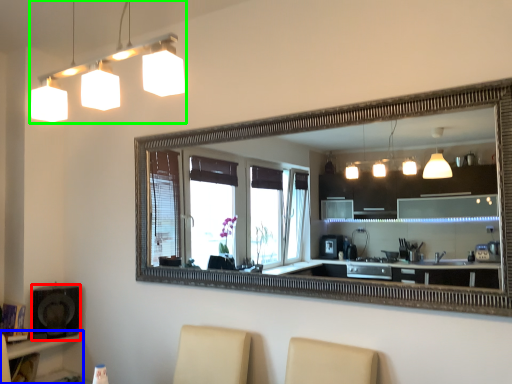
Question: Estimate the real-world distances between objects in this image. Which object is farther from speaker (highlighted by a red box), vanity (highlighted by a blue box) or lamp (highlighted by a green box)?

Choices:
 (A) vanity
 (B) lamp

Answer: (B)